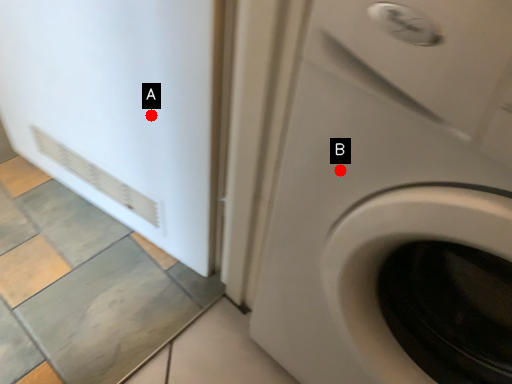
Question: Two points are circled on the image, labeled by A and B beside each circle. Among these points, which one is nearest to the camera?

Choices:
 (A) A is closer
 (B) B is closer

Answer: (B)